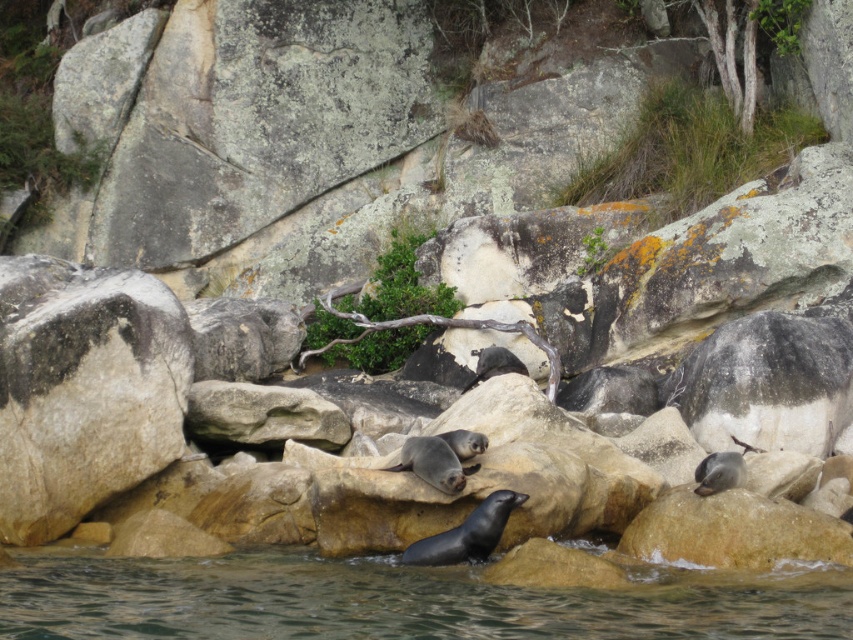
You are standing on a boat looking at the coastal scene. You notice the clear water at lower center and the gray rough rock at left. Which object is positioned more to the left side of the scene?

The gray rough rock at left is positioned more to the left side of the scene than the clear water at lower center.

You are standing on the shore and want to take a photo of the seals on the rocks. To ensure the clear water at lower center is in the center of your photo, should you move your camera slightly to the left or right?

The clear water at lower center is already positioned at the center of the frame at point coordinates, so you don not need to move your camera.